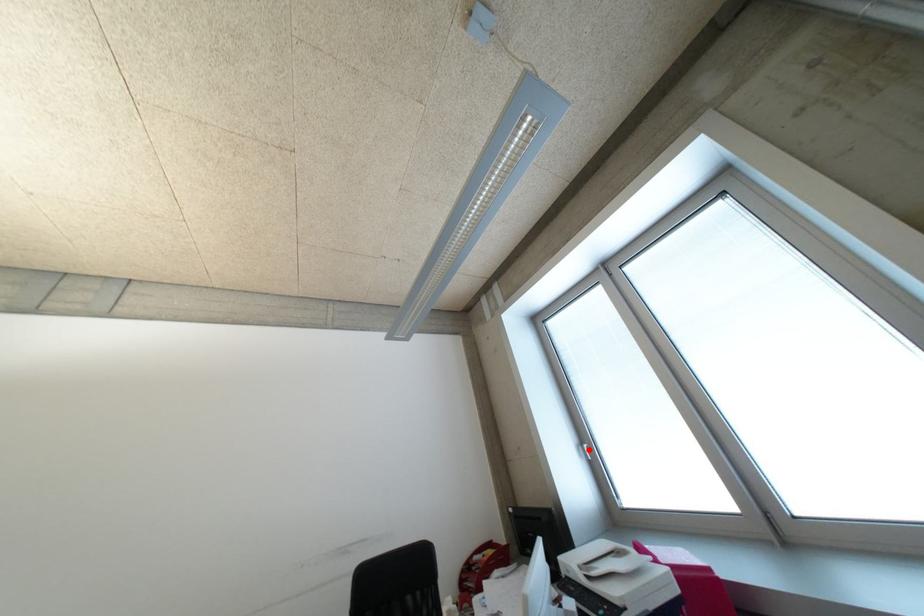
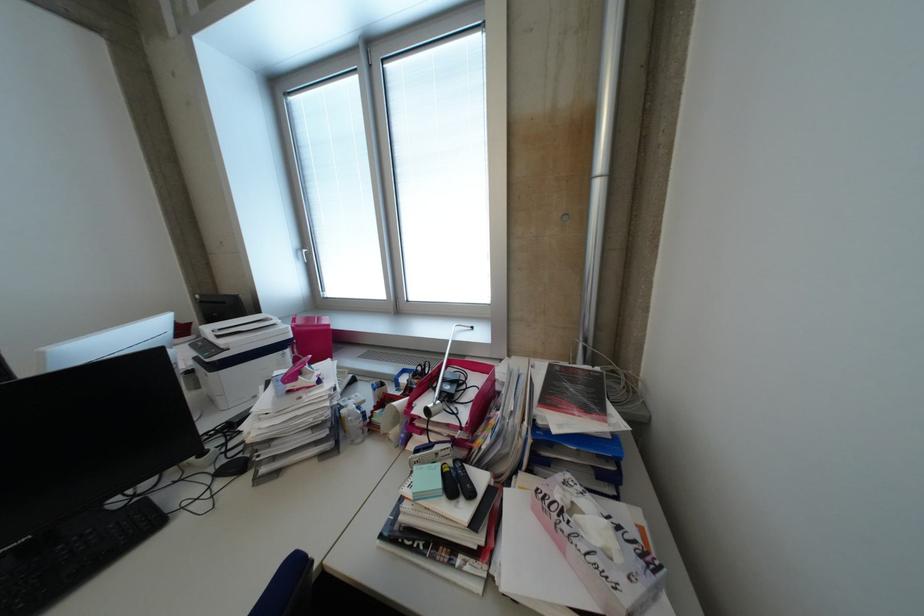
The point at the highlighted location is marked in the first image. Where is the corresponding point in the second image?

(309, 254)